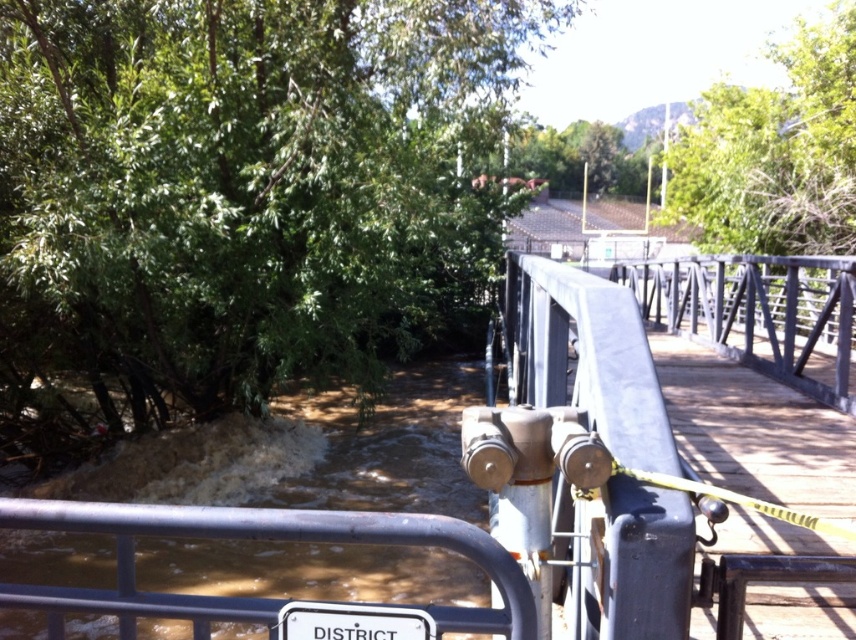
Is metallic gray bridge at center thinner than gray metallic rail at center?

Indeed, metallic gray bridge at center has a lesser width compared to gray metallic rail at center.

Does metallic gray bridge at center appear under gray metallic rail at center?

Yes.

Identify the location of metallic gray bridge at center. click(503, 497).

I want to click on metallic gray bridge at center, so click(503, 497).

Is metallic gray bridge at center to the right of white plastic street sign at lower center from the viewer's perspective?

Correct, you'll find metallic gray bridge at center to the right of white plastic street sign at lower center.

Between metallic gray bridge at center and white plastic street sign at lower center, which one appears on the left side from the viewer's perspective?

From the viewer's perspective, white plastic street sign at lower center appears more on the left side.

Which is behind, point (581, 497) or point (405, 612)?

Positioned behind is point (581, 497).

Locate an element on the screen. The image size is (856, 640). metallic gray bridge at center is located at coordinates (503, 497).

Which is above, gray metallic rail at center or white plastic street sign at lower center?

gray metallic rail at center is above.

Is gray metallic rail at center to the left of white plastic street sign at lower center from the viewer's perspective?

Incorrect, gray metallic rail at center is not on the left side of white plastic street sign at lower center.

Is point (721, 276) behind point (349, 612)?

Yes, it is.

The height and width of the screenshot is (640, 856). In order to click on gray metallic rail at center in this screenshot , I will do `click(759, 314)`.